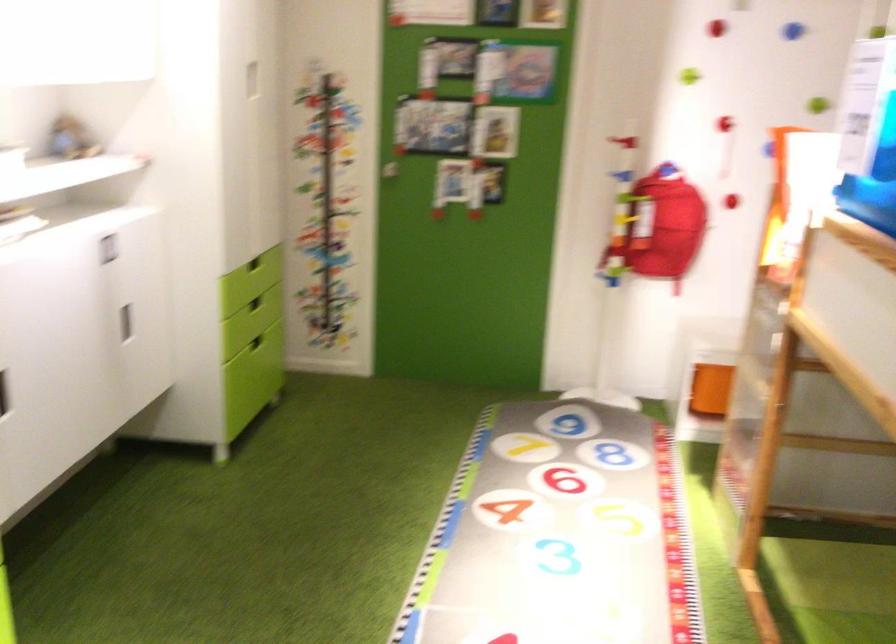
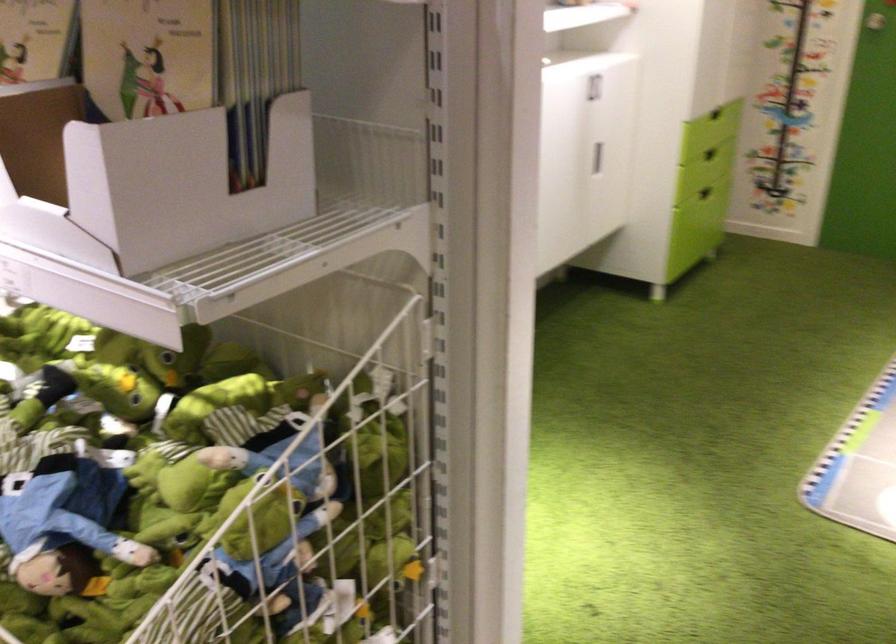
Locate, in the second image, the point that corresponds to pixel 133 323 in the first image.

(597, 158)